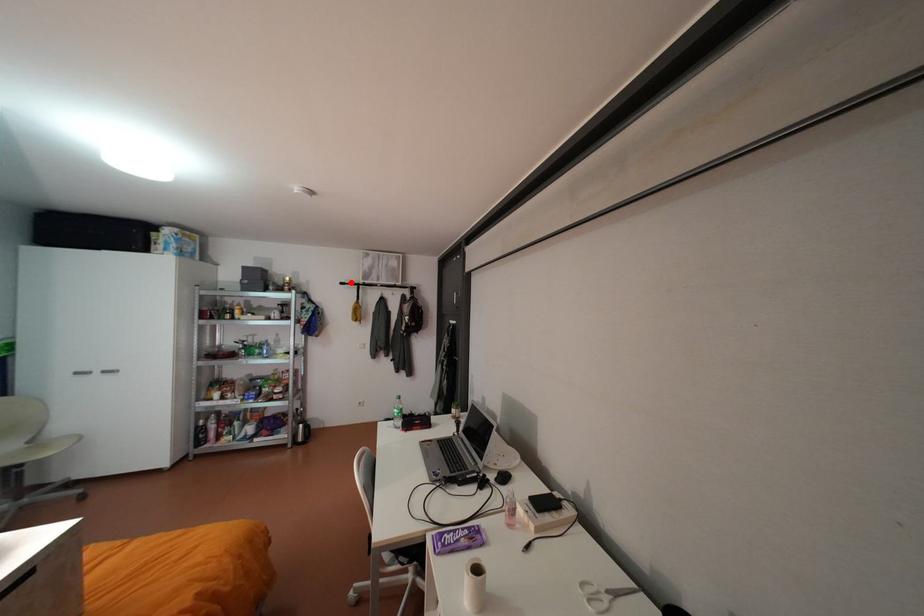
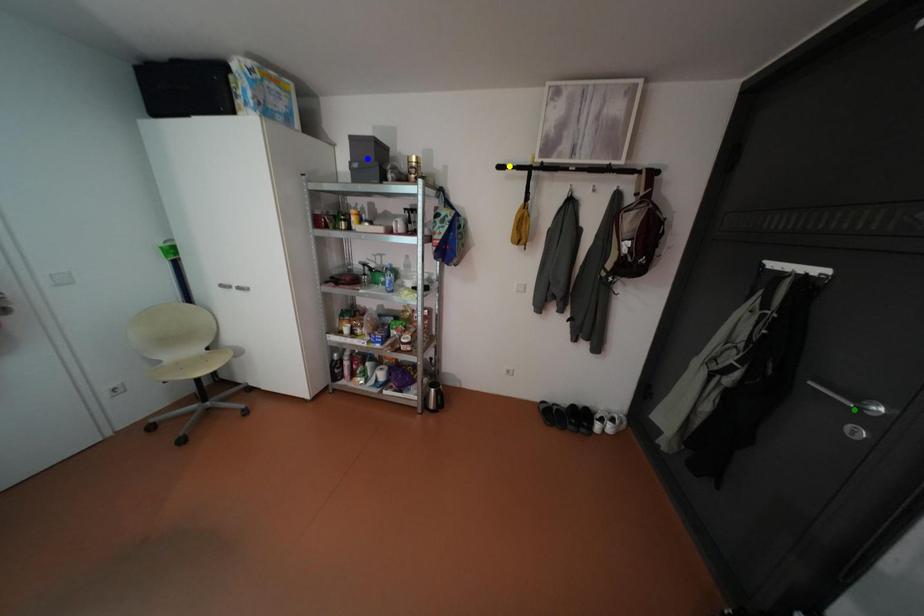
Question: I am providing you with two images of the same scene from different viewpoints. A red point is marked on the first image. You are given multiple points on the second image. Which mark in image 2 goes with the point in image 1?

Choices:
 (A) yellow point
 (B) green point
 (C) blue point

Answer: (A)